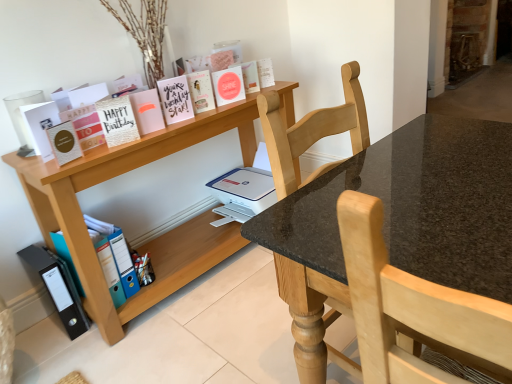
What is the approximate height of matte pink card at upper center, placed as the seventh paperback book when sorted from left to right?

6.85 inches.

How much space does pink matte card at upper center, which appears as the 5th paperback book when viewed from the left, occupy horizontally?

pink matte card at upper center, which appears as the 5th paperback book when viewed from the left, is 3.89 inches in width.

Image resolution: width=512 pixels, height=384 pixels. Describe the element at coordinates (64, 142) in the screenshot. I see `matte gold card at left, placed as the 2th paperback book when sorted from left to right` at that location.

How much space does matte gold card at left, placed as the 2th paperback book when sorted from left to right, occupy vertically?

The height of matte gold card at left, placed as the 2th paperback book when sorted from left to right, is 5.66 inches.

What is the approximate width of matte white card at left, marked as the 1th paperback book in a left-to-right arrangement?

It is 15.60 centimeters.

How much space does gold textured card at upper left, which appears as the 1th book when viewed from the top, occupy vertically?

It is 19.96 inches.

Where is `matte pink card at upper center, placed as the seventh paperback book when sorted from left to right`? Image resolution: width=512 pixels, height=384 pixels. matte pink card at upper center, placed as the seventh paperback book when sorted from left to right is located at coordinates (201, 91).

How many degrees apart are the facing directions of gold textured card at upper left, which is the seventh paperback book in right-to-left order, and matte pink paperback book at center, which is the third paperback book from right to left?

gold textured card at upper left, which is the seventh paperback book in right-to-left order, and matte pink paperback book at center, which is the third paperback book from right to left, are facing 2.32 degrees away from each other.

Is point (125, 114) closer to viewer compared to point (215, 84)?

Yes, it is.

Locate an element on the screen. This screenshot has width=512, height=384. the 4th paperback book below the matte pink paperback book at center, which is the third paperback book from right to left (from the image's perspective) is located at coordinates (117, 120).

Is gold textured card at upper left, marked as the 4th paperback book in a left-to-right arrangement, facing towards matte pink paperback book at center, arranged as the 8th paperback book when viewed from the left?

No.

Would you say wooden shelf at upper left is part of matte pink card at upper center, placed as the seventh paperback book when sorted from left to right,'s contents?

That's incorrect, wooden shelf at upper left is not inside matte pink card at upper center, placed as the seventh paperback book when sorted from left to right.

Which point is more distant from viewer, (200, 106) or (111, 155)?

Positioned behind is point (200, 106).

Is the position of matte pink card at upper center, placed as the seventh paperback book when sorted from left to right, more distant than that of wooden shelf at upper left?

Yes.

From the image's perspective, is matte pink card at upper center, placed as the seventh paperback book when sorted from left to right, positioned above or below wooden shelf at upper left?

Based on their image positions, matte pink card at upper center, placed as the seventh paperback book when sorted from left to right, is located above wooden shelf at upper left.

Based on their sizes in the image, would you say black granite table at center is bigger or smaller than gold textured card at upper left, marked as the second book in a bottom-to-top arrangement?

Clearly, black granite table at center is larger in size than gold textured card at upper left, marked as the second book in a bottom-to-top arrangement.

Is black granite table at center oriented towards gold textured card at upper left, marked as the second book in a bottom-to-top arrangement?

No, black granite table at center is not oriented towards gold textured card at upper left, marked as the second book in a bottom-to-top arrangement.

Does black granite table at center have a lesser width compared to gold textured card at upper left, which appears as the 1th book when viewed from the top?

Yes.

Are black granite table at center and gold textured card at upper left, which appears as the 1th book when viewed from the top, making contact?

No, black granite table at center is not beside gold textured card at upper left, which appears as the 1th book when viewed from the top.

Is hardcover book at upper center, the 10th paperback book in the left-to-right sequence, next to pink matte card at upper center, marked as the sixth paperback book in a right-to-left arrangement, and touching it?

hardcover book at upper center, the 10th paperback book in the left-to-right sequence, and pink matte card at upper center, marked as the sixth paperback book in a right-to-left arrangement, are clearly separated.

Considering the positions of point (259, 82) and point (145, 129), is point (259, 82) closer or farther from the camera than point (145, 129)?

Clearly, point (259, 82) is more distant from the camera than point (145, 129).

Do you think hardcover book at upper center, which appears as the 1th paperback book when viewed from the right, is within pink matte card at upper center, which appears as the 5th paperback book when viewed from the left, or outside of it?

hardcover book at upper center, which appears as the 1th paperback book when viewed from the right, is outside pink matte card at upper center, which appears as the 5th paperback book when viewed from the left.

How different are the orientations of wooden shelf at upper left and matte pink paperback book at center, arranged as the 8th paperback book when viewed from the left, in degrees?

11.3 degrees separate the facing orientations of wooden shelf at upper left and matte pink paperback book at center, arranged as the 8th paperback book when viewed from the left.

Does wooden shelf at upper left turn towards matte pink paperback book at center, arranged as the 8th paperback book when viewed from the left?

No, wooden shelf at upper left does not turn towards matte pink paperback book at center, arranged as the 8th paperback book when viewed from the left.

Which is behind, point (163, 280) or point (219, 99)?

The point (219, 99) is more distant.

From the image's perspective, is matte pink paperback book at center, which is the third paperback book from right to left, on top of gold textured card at upper left, which is the seventh paperback book in right-to-left order?

Yes, from the image's perspective, matte pink paperback book at center, which is the third paperback book from right to left, is on top of gold textured card at upper left, which is the seventh paperback book in right-to-left order.

From the picture: Considering the relative sizes of matte pink paperback book at center, arranged as the 8th paperback book when viewed from the left, and gold textured card at upper left, marked as the 4th paperback book in a left-to-right arrangement, in the image provided, is matte pink paperback book at center, arranged as the 8th paperback book when viewed from the left, wider than gold textured card at upper left, marked as the 4th paperback book in a left-to-right arrangement,?

Yes.

Can you tell me how much matte pink paperback book at center, arranged as the 8th paperback book when viewed from the left, and gold textured card at upper left, which is the seventh paperback book in right-to-left order, differ in facing direction?

2.32 degrees separate the facing orientations of matte pink paperback book at center, arranged as the 8th paperback book when viewed from the left, and gold textured card at upper left, which is the seventh paperback book in right-to-left order.

Is point (219, 102) farther from viewer compared to point (122, 112)?

That is True.

From a real-world perspective, is matte pink card at upper center, the sixth paperback book when ordered from left to right, on top of matte gold card at left, which ranks as the ninth paperback book in right-to-left order?

Yes.

Who is shorter, matte pink card at upper center, the sixth paperback book when ordered from left to right, or matte gold card at left, placed as the 2th paperback book when sorted from left to right?

Standing shorter between the two is matte gold card at left, placed as the 2th paperback book when sorted from left to right.

Which is behind, point (167, 122) or point (72, 160)?

The point (167, 122) is behind.

Is matte pink card at upper center, the sixth paperback book when ordered from left to right, in contact with matte gold card at left, placed as the 2th paperback book when sorted from left to right?

There is a gap between matte pink card at upper center, the sixth paperback book when ordered from left to right, and matte gold card at left, placed as the 2th paperback book when sorted from left to right.

From a real-world perspective, which paperback book is the 3rd one above the matte pink paperback book at center, arranged as the 8th paperback book when viewed from the left? Please provide its 2D coordinates.

[(117, 120)]

Where is `shelf below the matte pink card at upper center, the 4th paperback book when ordered from right to left (from a real-world perspective)`? The width and height of the screenshot is (512, 384). shelf below the matte pink card at upper center, the 4th paperback book when ordered from right to left (from a real-world perspective) is located at coordinates (156, 238).

Considering their positions, is pink matte card at upper center, which appears as the 5th paperback book when viewed from the left, positioned closer to matte gold card at left, which ranks as the ninth paperback book in right-to-left order, than hardcover book at upper center, which appears as the 1th paperback book when viewed from the right?

pink matte card at upper center, which appears as the 5th paperback book when viewed from the left, is positioned closer to the anchor matte gold card at left, which ranks as the ninth paperback book in right-to-left order.

From the image, which object appears to be farther from blue plastic file at lower left, the 1th book positioned from the bottom, matte pink card at upper center, placed as the seventh paperback book when sorted from left to right, or blue plastic folder at lower left, which appears as the 3th paperback book when viewed from the left?

matte pink card at upper center, placed as the seventh paperback book when sorted from left to right, lies further to blue plastic file at lower left, the 1th book positioned from the bottom, than the other object.

When comparing their distances from black plastic bin at lower left, does blue plastic folder at lower left, marked as the 8th paperback book in a right-to-left arrangement, or matte pink paperback book at center, arranged as the 8th paperback book when viewed from the left, seem further?

matte pink paperback book at center, arranged as the 8th paperback book when viewed from the left.

Estimate the real-world distances between objects in this image. Which object is further from matte pink card at upper center, the sixth paperback book when ordered from left to right, pink matte card at upper center, which appears as the 5th paperback book when viewed from the left, or blue plastic file at lower left, the 1th book positioned from the bottom?

The object further to matte pink card at upper center, the sixth paperback book when ordered from left to right, is blue plastic file at lower left, the 1th book positioned from the bottom.

When comparing their distances from matte pink paper at upper center, the 2th paperback book viewed from the right, does matte pink card at upper center, the sixth paperback book when ordered from left to right, or wooden shelf at upper left seem closer?

matte pink card at upper center, the sixth paperback book when ordered from left to right, is positioned closer to the anchor matte pink paper at upper center, the 2th paperback book viewed from the right.

Looking at the image, which one is located closer to black plastic bin at lower left, black granite table at center or matte white card at left, marked as the 1th paperback book in a left-to-right arrangement?

The object closer to black plastic bin at lower left is matte white card at left, marked as the 1th paperback book in a left-to-right arrangement.

Looking at the image, which one is located closer to matte gold card at left, placed as the 2th paperback book when sorted from left to right, matte pink card at upper center, the 4th paperback book when ordered from right to left, or black granite table at center?

matte pink card at upper center, the 4th paperback book when ordered from right to left, lies closer to matte gold card at left, placed as the 2th paperback book when sorted from left to right, than the other object.

Based on their spatial positions, is matte white card at left, marked as the 1th paperback book in a left-to-right arrangement, or blue plastic file at lower left, which appears as the second book when viewed from the top, closer to matte gold card at left, which ranks as the ninth paperback book in right-to-left order?

matte white card at left, marked as the 1th paperback book in a left-to-right arrangement, is closer to matte gold card at left, which ranks as the ninth paperback book in right-to-left order.

Where is `shelf located between gold textured card at upper left, marked as the 4th paperback book in a left-to-right arrangement, and black granite table at center in the left-right direction`? The width and height of the screenshot is (512, 384). shelf located between gold textured card at upper left, marked as the 4th paperback book in a left-to-right arrangement, and black granite table at center in the left-right direction is located at coordinates (156, 238).

The height and width of the screenshot is (384, 512). I want to click on shelf between gold textured card at upper left, which appears as the 1th book when viewed from the top, and hardcover book at upper center, which appears as the 1th paperback book when viewed from the right, along the z-axis, so click(156, 238).

Find the location of a particular element. The height and width of the screenshot is (384, 512). book between gold textured card at upper left, which is the seventh paperback book in right-to-left order, and black granite table at center, in the horizontal direction is located at coordinates (221, 56).

Locate an element on the screen. The width and height of the screenshot is (512, 384). shelf situated between matte gold card at left, placed as the 2th paperback book when sorted from left to right, and matte pink card at upper center, which ranks as the fifth paperback book in right-to-left order, from left to right is located at coordinates (156, 238).